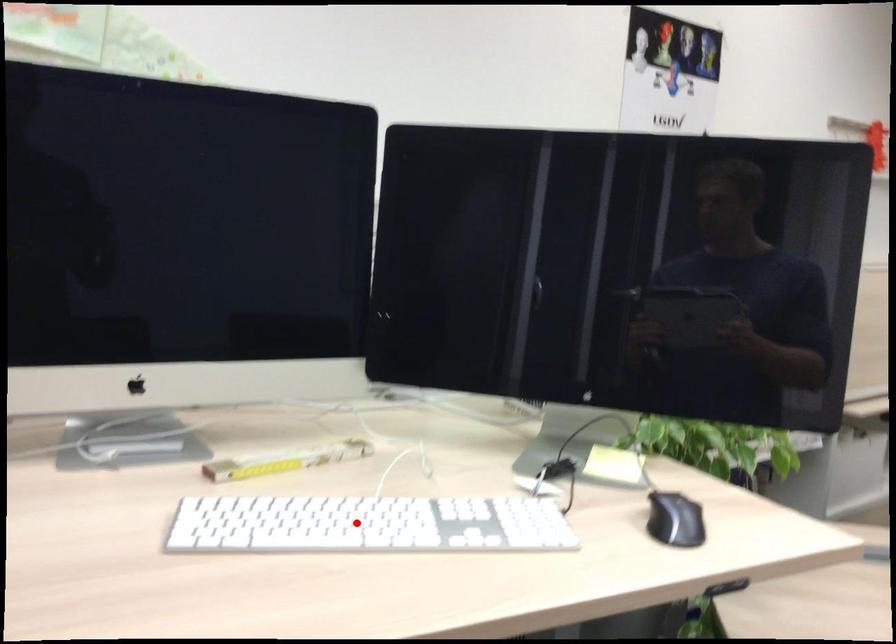
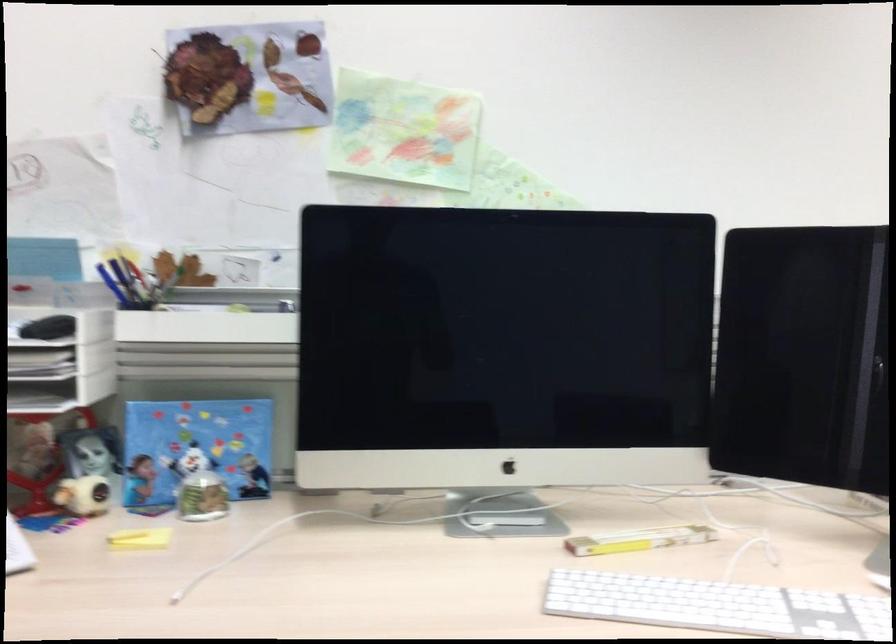
The point at the highlighted location is marked in the first image. Where is the corresponding point in the second image?

(717, 605)